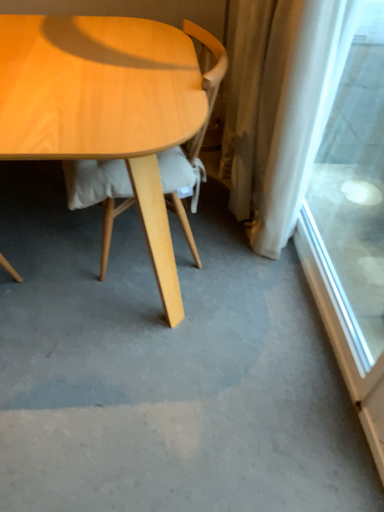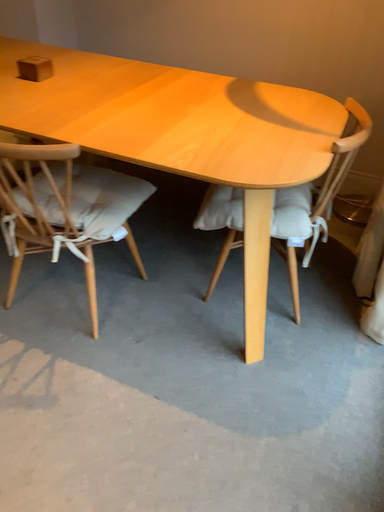
Question: Which way did the camera rotate in the video?

Choices:
 (A) rotated downward
 (B) rotated upward

Answer: (B)